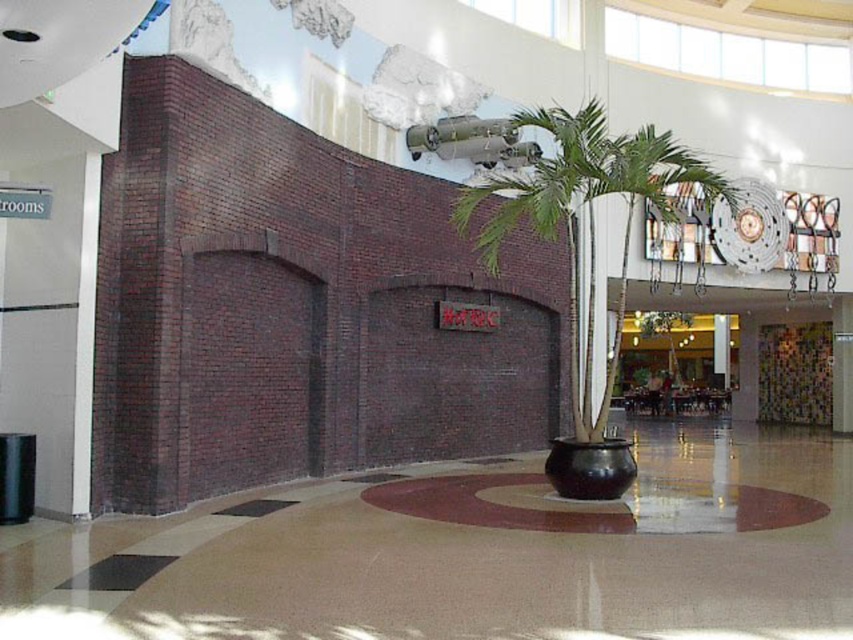
Question: Can you confirm if green glossy palm tree at center is positioned below shiny black vase at center?

Choices:
 (A) yes
 (B) no

Answer: (B)

Question: Which object is farther from the camera taking this photo?

Choices:
 (A) green glossy palm tree at center
 (B) shiny black vase at center

Answer: (A)

Question: Does green glossy palm tree at center appear under shiny black vase at center?

Choices:
 (A) no
 (B) yes

Answer: (A)

Question: Is green glossy palm tree at center thinner than shiny black vase at center?

Choices:
 (A) no
 (B) yes

Answer: (A)

Question: Which of the following is the closest to the observer?

Choices:
 (A) green glossy palm tree at center
 (B) shiny black vase at center

Answer: (B)